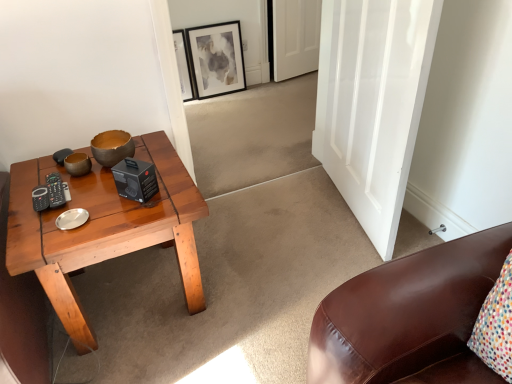
This screenshot has width=512, height=384. I want to click on vacant space underneath white glossy door at center, which is the 2th door from top to bottom (from a real-world perspective), so click(342, 217).